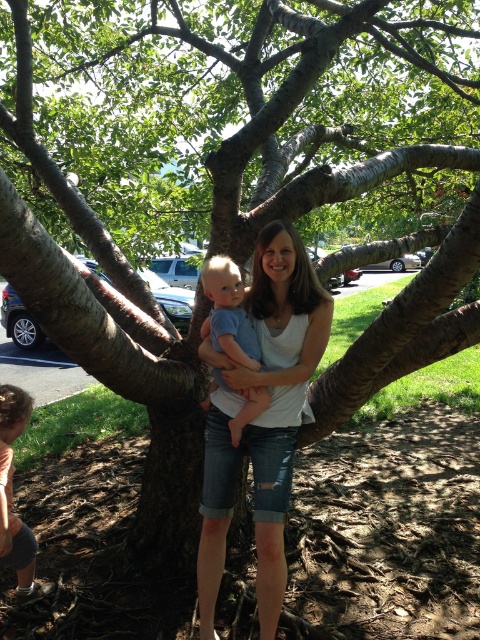
Question: Is blue cotton shirt at center bigger than light brown hair at lower left?

Choices:
 (A) yes
 (B) no

Answer: (A)

Question: Which object is the closest to the blue cotton shirt at center?

Choices:
 (A) light brown hair at lower left
 (B) white cotton shirt at center

Answer: (B)

Question: Does blue cotton shirt at center have a smaller size compared to light brown hair at lower left?

Choices:
 (A) yes
 (B) no

Answer: (B)

Question: Does blue cotton shirt at center have a lesser width compared to light brown hair at lower left?

Choices:
 (A) no
 (B) yes

Answer: (A)

Question: Which of these objects is positioned farthest from the light brown hair at lower left?

Choices:
 (A) blue cotton shirt at center
 (B) white cotton shirt at center

Answer: (A)

Question: Among these points, which one is farthest from the camera?

Choices:
 (A) (240, 289)
 (B) (291, 353)
 (C) (0, 536)

Answer: (A)